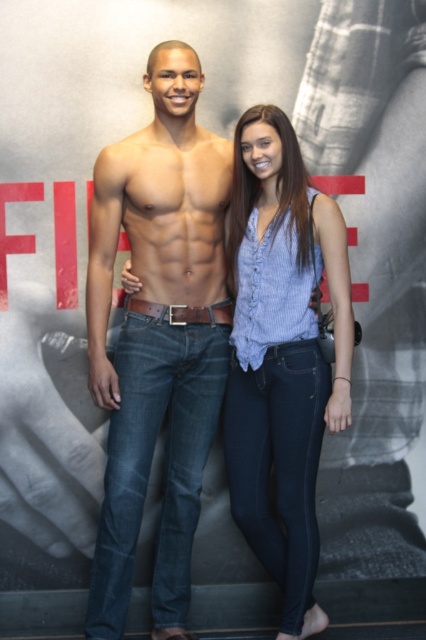
Which of these two, matte black torso at center or blue denim jeans at center, stands taller?

Standing taller between the two is matte black torso at center.

Is matte black torso at center to the left of blue denim jeans at center from the viewer's perspective?

Indeed, matte black torso at center is positioned on the left side of blue denim jeans at center.

Is point (196, 435) closer to camera compared to point (284, 504)?

That is False.

You are a GUI agent. You are given a task and a screenshot of the screen. Output one action in this format:
    pyautogui.click(x=<x>, y=<y>)
    Task: Click on the matte black torso at center
    
    Given the screenshot: What is the action you would take?
    pyautogui.click(x=158, y=337)